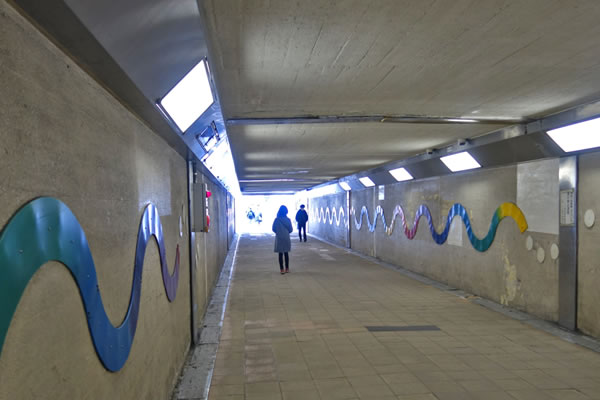
At what (x,y) coordinates should I click in order to perform the action: click on left wall. Please return your answer as a coordinate pair (x, y). This screenshot has height=400, width=600. Looking at the image, I should click on (215, 239).